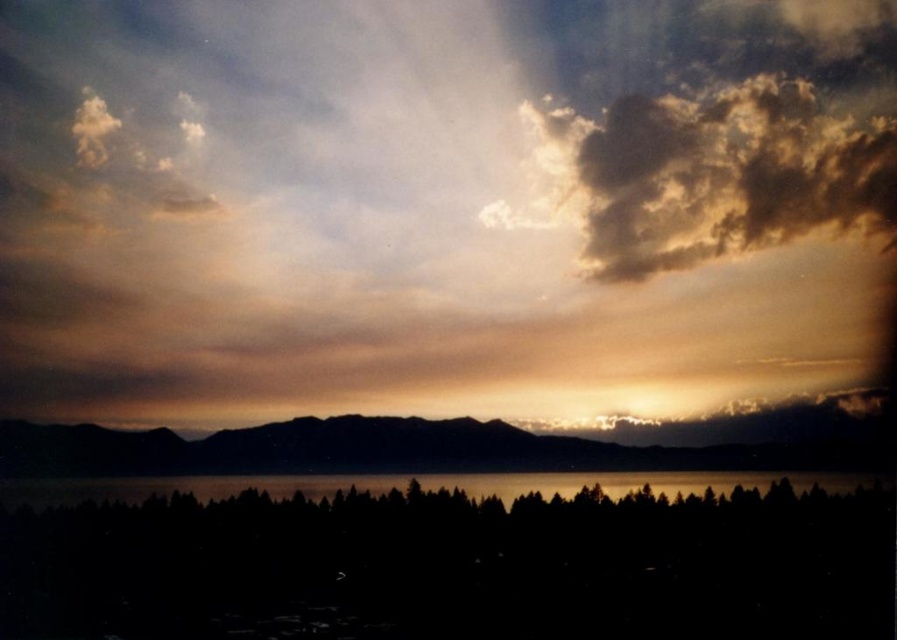
Is point (450, 269) positioned in front of point (224, 448)?

Yes.

Looking at this image, is smokey gray cloud at upper center above silhouette mountain at center?

Correct, smokey gray cloud at upper center is located above silhouette mountain at center.

The width and height of the screenshot is (897, 640). I want to click on smokey gray cloud at upper center, so click(438, 208).

Between point (214, 266) and point (318, 492), which one is positioned in front?

Point (214, 266)

Does smokey gray cloud at upper center lie in front of black water at center?

Yes, smokey gray cloud at upper center is closer to the viewer.

Where is `smokey gray cloud at upper center`? smokey gray cloud at upper center is located at coordinates (438, 208).

Identify the location of smokey gray cloud at upper center. This screenshot has width=897, height=640. pos(438,208).

Who is shorter, smokey gray cloud at upper center or black matte trees at bottom?

Standing shorter between the two is black matte trees at bottom.

Who is more forward, (214,3) or (44,518)?

Point (214,3)

Is point (376, 355) closer to camera compared to point (42, 579)?

That is True.

This screenshot has height=640, width=897. What are the coordinates of `smokey gray cloud at upper center` in the screenshot? It's located at (438, 208).